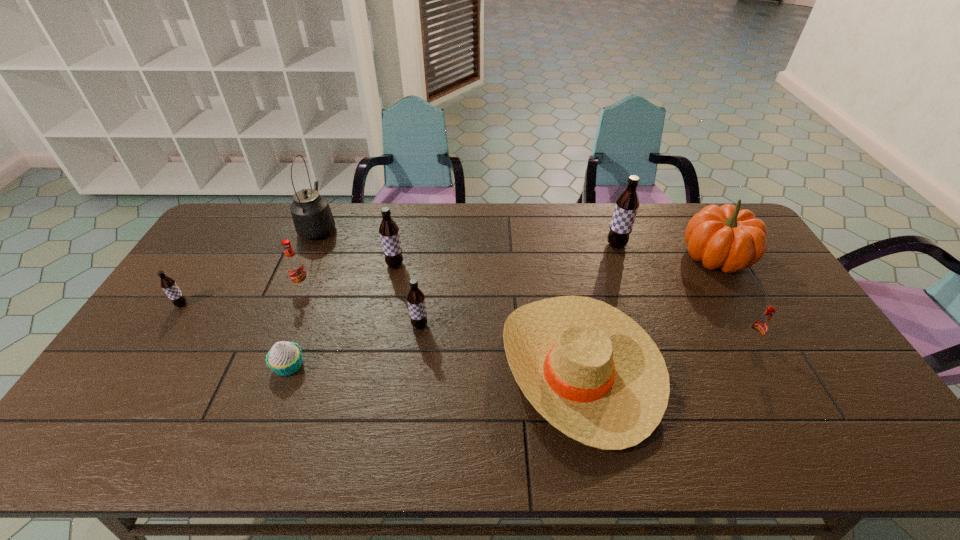
Locate an element on the screen. The width and height of the screenshot is (960, 540). vacant space located 0.090m on the front of the left red root beer is located at coordinates (291, 313).

I want to click on free spot located on the left of the fifth object from right to left, so click(x=322, y=326).

I want to click on free space located 0.260m on the right of the smallest brown root beer, so click(274, 305).

Locate an element on the screen. The width and height of the screenshot is (960, 540). vacant space located on the left of the nearer red root beer is located at coordinates (652, 341).

I want to click on vacant space located on the left of the sunhat, so click(x=397, y=368).

The height and width of the screenshot is (540, 960). In order to click on vacant space positioned on the front of the white cupcake in this screenshot , I will do `click(260, 443)`.

Where is `kettle located at the far edge`? kettle located at the far edge is located at coordinates point(311,213).

Where is `root beer that is at the far edge`? root beer that is at the far edge is located at coordinates (626, 207).

Locate an element on the screen. Image resolution: width=960 pixels, height=540 pixels. pumpkin that is at the far edge is located at coordinates (727, 237).

This screenshot has height=540, width=960. Identify the location of object that is at the near edge. (591, 371).